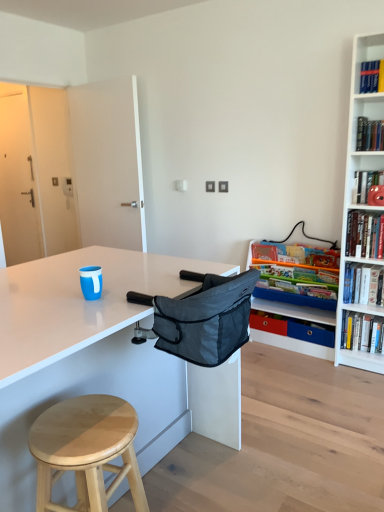
The height and width of the screenshot is (512, 384). What are the coordinates of `free space above red plastic drawer at lower right (from a real-world perspective)` in the screenshot? It's located at (263, 309).